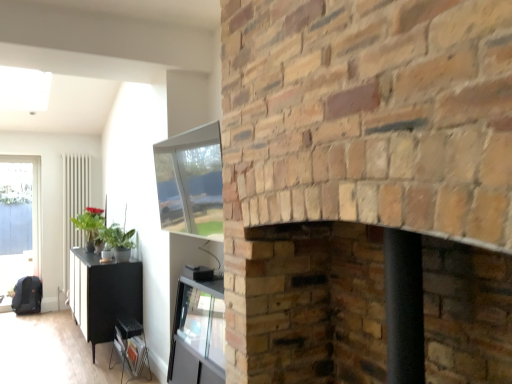
Question: In the image, is white glossy radiator at left on the left side or the right side of brick fireplace at center, arranged as the first fireplace when viewed from the top?

Choices:
 (A) right
 (B) left

Answer: (B)

Question: Would you say white glossy radiator at left is inside or outside brick fireplace at center, arranged as the first fireplace when viewed from the top?

Choices:
 (A) outside
 (B) inside

Answer: (A)

Question: Based on their relative distances, which object is farther from the transparent glass door at left?

Choices:
 (A) smooth brick fireplace at center, acting as the second fireplace starting from the top
 (B) green matte plant at left
 (C) brick fireplace at center, the second fireplace ordered from the bottom
 (D) white glossy radiator at left
 (E) black matte cabinet at lower left

Answer: (C)

Question: Which of these objects is positioned closest to the smooth brick fireplace at center, acting as the second fireplace starting from the top?

Choices:
 (A) transparent glass door at left
 (B) brick fireplace at center, the second fireplace ordered from the bottom
 (C) black matte cabinet at lower left
 (D) green matte plant at left
 (E) white glossy radiator at left

Answer: (B)